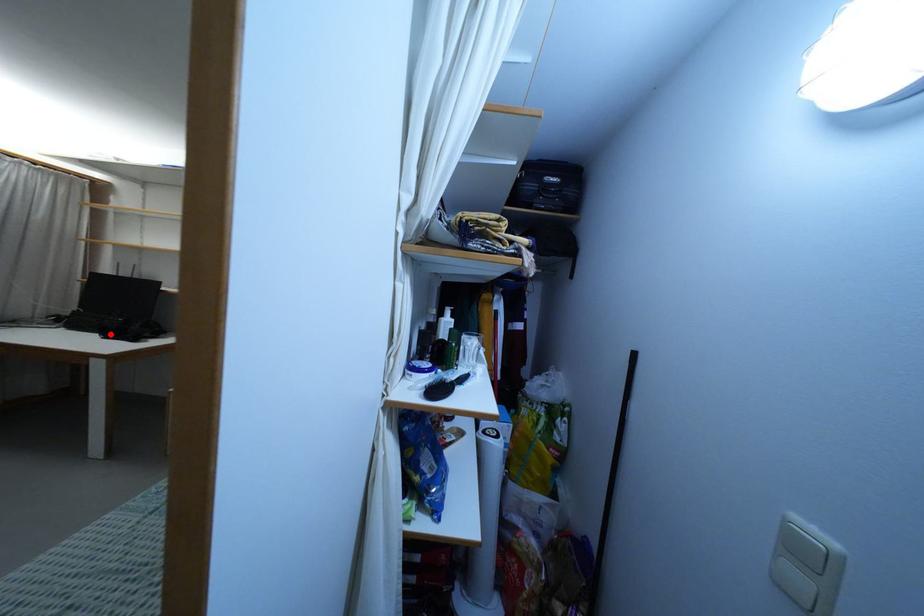
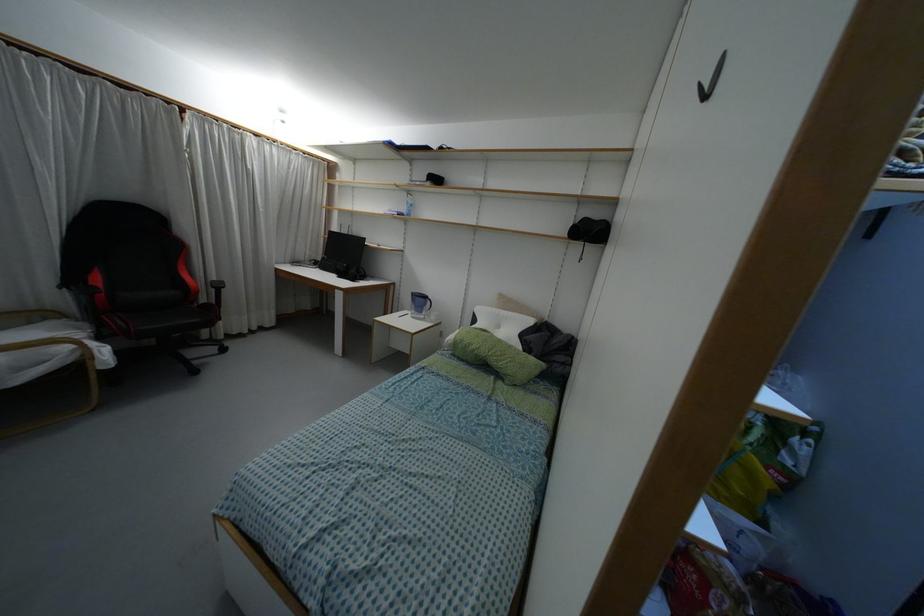
The point at the highlighted location is marked in the first image. Where is the corresponding point in the second image?

(341, 275)